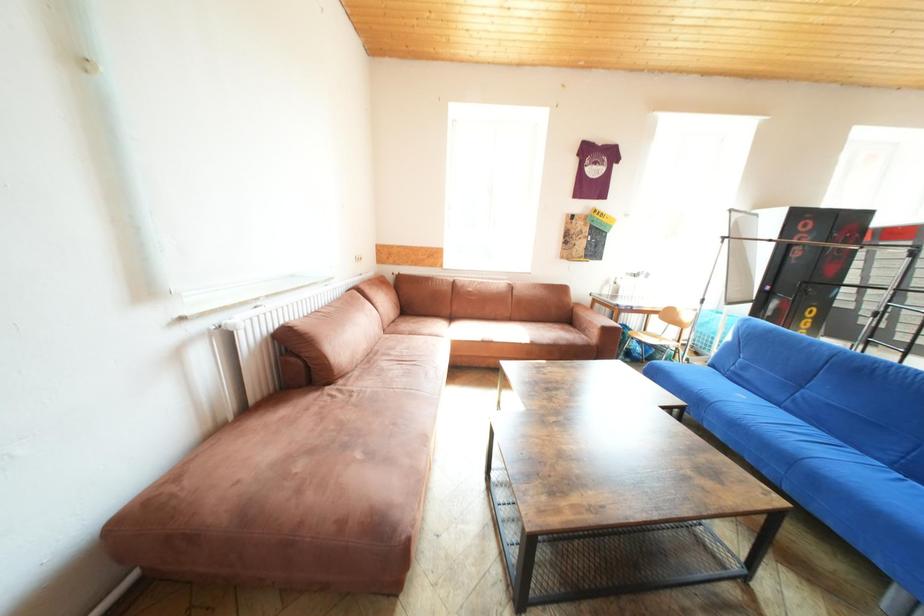
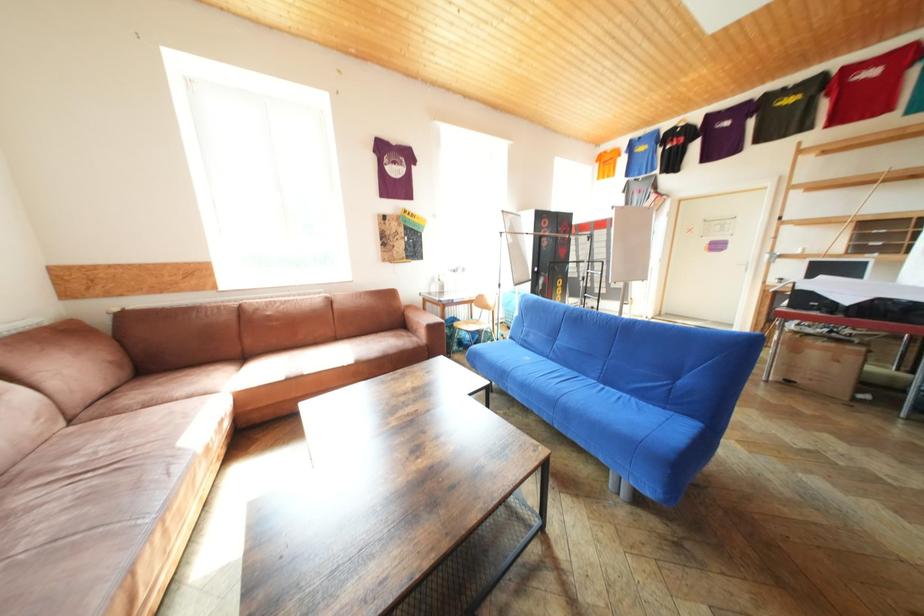
Question: The first image is from the beginning of the video and the second image is from the end. How did the camera likely rotate when shooting the video?

Choices:
 (A) Left
 (B) Right
 (C) Up
 (D) Down

Answer: (B)